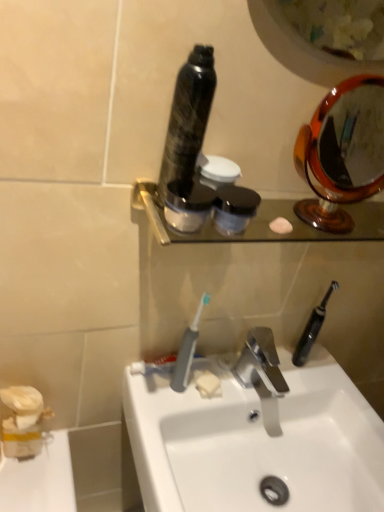
The height and width of the screenshot is (512, 384). I want to click on vacant area that is situated to the right of white matte soap at center, so click(x=271, y=387).